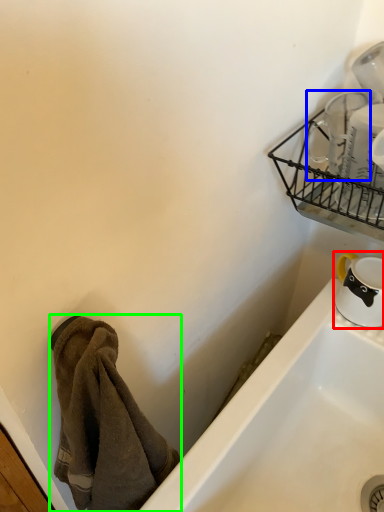
Question: Considering the real-world distances, which object is closest to tableware (highlighted by a red box)? tableware (highlighted by a blue box) or towel/napkin (highlighted by a green box).

Choices:
 (A) tableware
 (B) towel/napkin

Answer: (A)